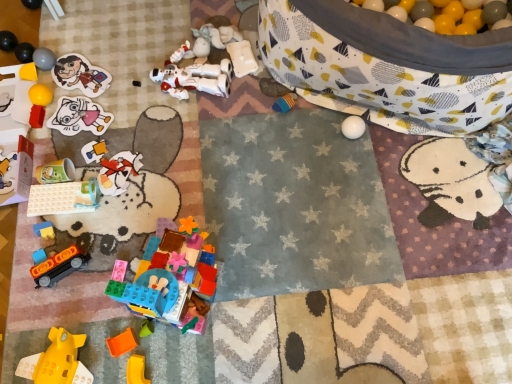
Question: Is translucent plastic building blocks at lower center, positioned as the sixth toy in bottom-to-top order, aimed at matte plastic cup at upper left, which appears as the 17th toy when ordered from the bottom?

Choices:
 (A) no
 (B) yes

Answer: (A)

Question: From a real-world perspective, is translucent plastic building blocks at lower center, placed as the 12th toy when sorted from top to bottom, over matte plastic cup at upper left, which appears as the 17th toy when ordered from the bottom?

Choices:
 (A) yes
 (B) no

Answer: (A)

Question: Does translucent plastic building blocks at lower center, placed as the 12th toy when sorted from top to bottom, appear on the left side of matte plastic cup at upper left, which appears as the 17th toy when ordered from the bottom?

Choices:
 (A) no
 (B) yes

Answer: (A)

Question: Is translucent plastic building blocks at lower center, placed as the 12th toy when sorted from top to bottom, in contact with matte plastic cup at upper left, positioned as the 1th toy in top-to-bottom order?

Choices:
 (A) yes
 (B) no

Answer: (B)

Question: From the image's perspective, is translucent plastic building blocks at lower center, placed as the 12th toy when sorted from top to bottom, beneath matte plastic cup at upper left, positioned as the 1th toy in top-to-bottom order?

Choices:
 (A) no
 (B) yes

Answer: (B)

Question: From the image's perspective, relative to white matte toy at upper center, which is the sixteenth toy from bottom to top, is matte paper sticker at upper left, positioned as the eleventh toy in bottom-to-top order, above or below?

Choices:
 (A) below
 (B) above

Answer: (A)

Question: Visually, is matte paper sticker at upper left, which ranks as the seventh toy in top-to-bottom order, positioned to the left or to the right of white matte toy at upper center, the second toy viewed from the top?

Choices:
 (A) left
 (B) right

Answer: (A)

Question: Is point (80, 105) positioned closer to the camera than point (245, 66)?

Choices:
 (A) farther
 (B) closer

Answer: (B)

Question: From a real-world perspective, is matte paper sticker at upper left, positioned as the eleventh toy in bottom-to-top order, positioned above or below white matte toy at upper center, which is the sixteenth toy from bottom to top?

Choices:
 (A) below
 (B) above

Answer: (A)

Question: Is matte plastic cup at upper left, which appears as the 17th toy when ordered from the bottom, inside or outside of translucent plastic cup at left, which appears as the eighth toy when viewed from the top?

Choices:
 (A) outside
 (B) inside

Answer: (A)

Question: Is matte plastic cup at upper left, which appears as the 17th toy when ordered from the bottom, in front of or behind translucent plastic cup at left, which appears as the eighth toy when viewed from the top, in the image?

Choices:
 (A) front
 (B) behind

Answer: (B)

Question: From a real-world perspective, is matte plastic cup at upper left, positioned as the 1th toy in top-to-bottom order, positioned above or below translucent plastic cup at left, the 10th toy ordered from the bottom?

Choices:
 (A) above
 (B) below

Answer: (A)

Question: Looking at the image, does matte plastic cup at upper left, which appears as the 17th toy when ordered from the bottom, seem bigger or smaller compared to translucent plastic cup at left, the 10th toy ordered from the bottom?

Choices:
 (A) small
 (B) big

Answer: (A)

Question: Choose the correct answer: Is matte paper sticker at upper left, which ranks as the seventh toy in top-to-bottom order, inside matte plastic cup at lower left, positioned as the 9th toy in bottom-to-top order, or outside it?

Choices:
 (A) outside
 (B) inside

Answer: (A)

Question: Considering the positions of matte paper sticker at upper left, which ranks as the seventh toy in top-to-bottom order, and matte plastic cup at lower left, placed as the ninth toy when sorted from top to bottom, in the image, is matte paper sticker at upper left, which ranks as the seventh toy in top-to-bottom order, taller or shorter than matte plastic cup at lower left, placed as the ninth toy when sorted from top to bottom,?

Choices:
 (A) tall
 (B) short

Answer: (B)